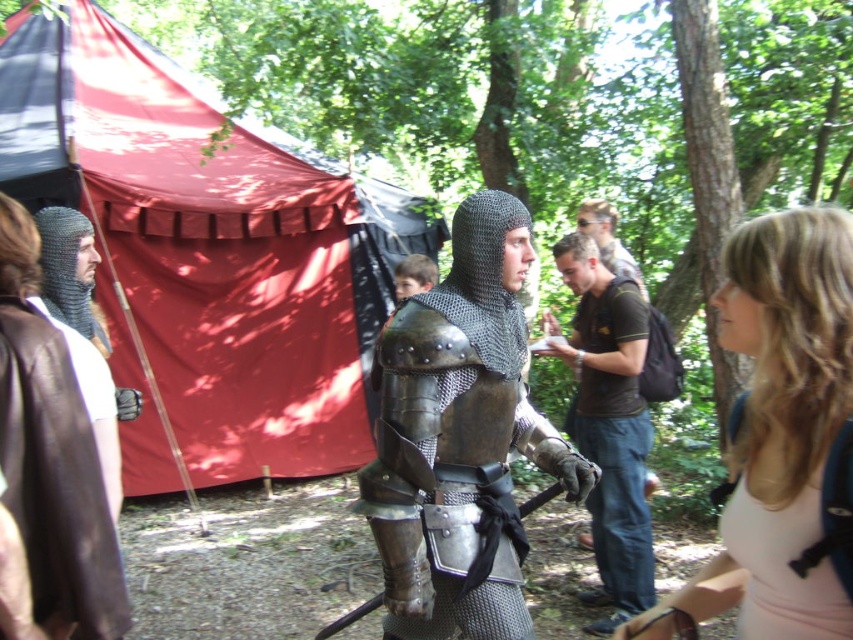
You are a photographer at the medieval fair and want to focus on the two points marked in the scene. Which point, point [73,390] or point [613,547], is closer to your camera lens?

Point [73,390] is closer to the camera than point [613,547].

You are standing in a medieval fair and see the armored figure and the brown leather cape at left. Which object is closer to the front of the scene?

The brown leather cape at left is located at point (56, 480), which places it closer to the front of the scene compared to the armored figure.

In the scene shown: You are standing in the medieval fair and see two points marked in the image. Which point is closer to you, point (405,445) or point (611,481)?

Point (405,445) is closer to the viewer than point (611,481).